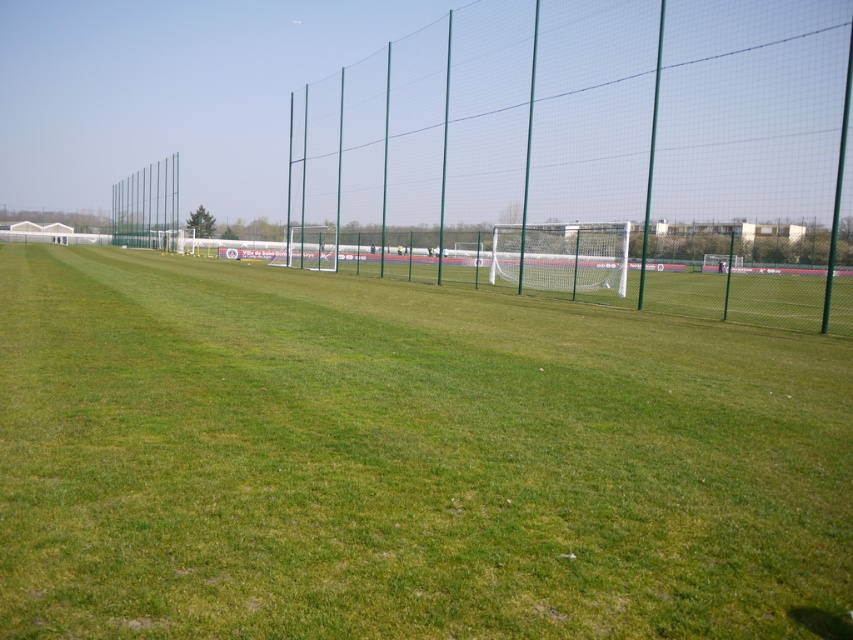
Does green grass at center have a lesser width compared to green mesh fence at center?

Correct, green grass at center's width is less than green mesh fence at center's.

Between green grass at center and green mesh fence at center, which one has more height?

green mesh fence at center

Is point (346, 355) more distant than point (693, 61)?

No, it is in front of (693, 61).

The height and width of the screenshot is (640, 853). I want to click on green grass at center, so click(x=404, y=460).

Can you confirm if green mesh fence at center is shorter than green mesh fence at upper left?

Incorrect, green mesh fence at center's height does not fall short of green mesh fence at upper left's.

Can you confirm if green mesh fence at center is positioned below green mesh fence at upper left?

Incorrect, green mesh fence at center is not positioned below green mesh fence at upper left.

Is point (329, 243) in front of point (144, 234)?

That is True.

You are a GUI agent. You are given a task and a screenshot of the screen. Output one action in this format:
    pyautogui.click(x=<x>, y=<y>)
    Task: Click on the green mesh fence at center
    
    Given the screenshot: What is the action you would take?
    pyautogui.click(x=595, y=156)

Does point (537, 436) lie behind point (158, 168)?

No, (537, 436) is in front of (158, 168).

Is point (843, 396) less distant than point (134, 177)?

That is True.

Locate an element on the screen. The height and width of the screenshot is (640, 853). green grass at center is located at coordinates (404, 460).